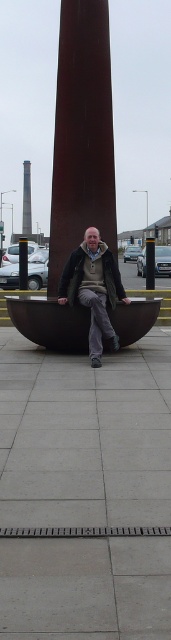
Question: Which of the following is the farthest from the observer?

Choices:
 (A) (24, 182)
 (B) (21, 301)

Answer: (A)

Question: Is matte gray jacket at center in front of smooth brown tower at center?

Choices:
 (A) yes
 (B) no

Answer: (A)

Question: Is matte brown boat at center to the left of smooth brown tower at center from the viewer's perspective?

Choices:
 (A) yes
 (B) no

Answer: (B)

Question: Estimate the real-world distances between objects in this image. Which object is closer to the matte gray jacket at center?

Choices:
 (A) smooth brown tower at center
 (B) matte brown boat at center

Answer: (B)

Question: Is matte brown boat at center bigger than smooth brown tower at center?

Choices:
 (A) no
 (B) yes

Answer: (A)

Question: Which of the following is the farthest from the observer?

Choices:
 (A) rustic metal sculpture at center
 (B) matte gray jacket at center
 (C) matte brown boat at center
 (D) smooth brown tower at center

Answer: (D)